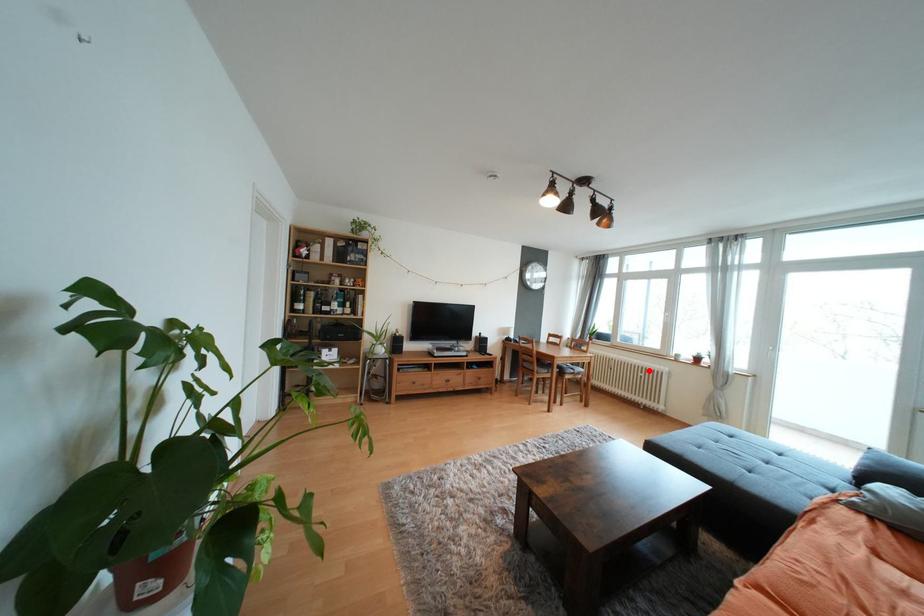
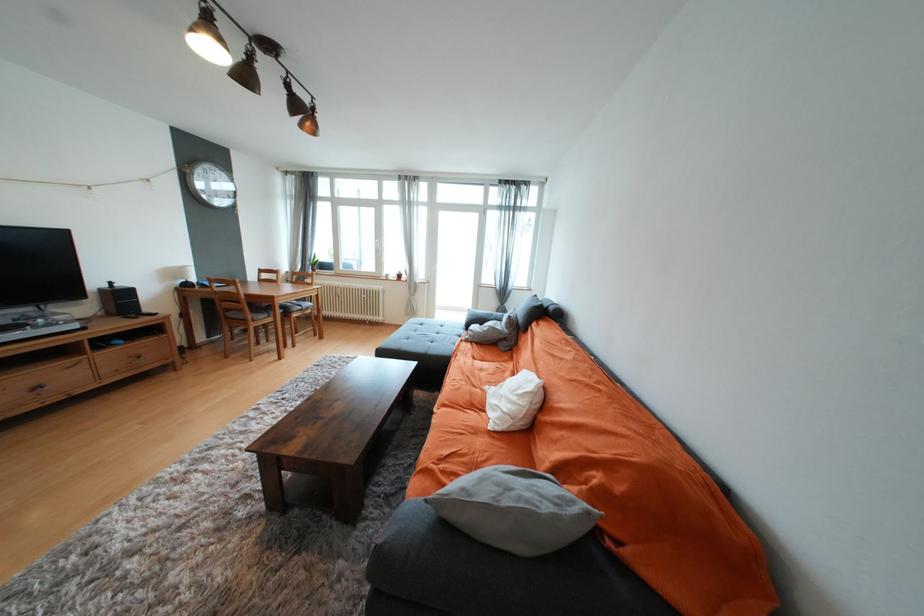
Question: I am providing you with two images of the same scene from different viewpoints. A red point is shown in image1. For the corresponding object point in image2, is it positioned nearer or farther from the camera?

Choices:
 (A) Nearer
 (B) Farther

Answer: (B)